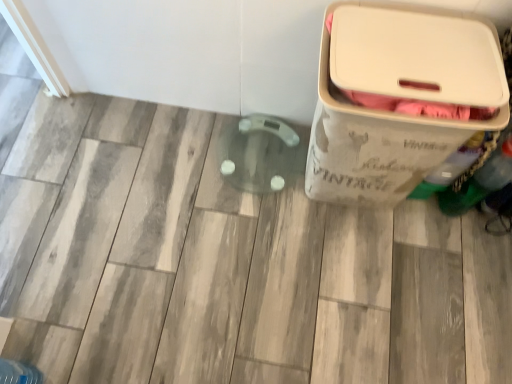
Locate an element on the screen. Image resolution: width=512 pixels, height=384 pixels. vacant position to the left of beige plastic container at right is located at coordinates (245, 201).